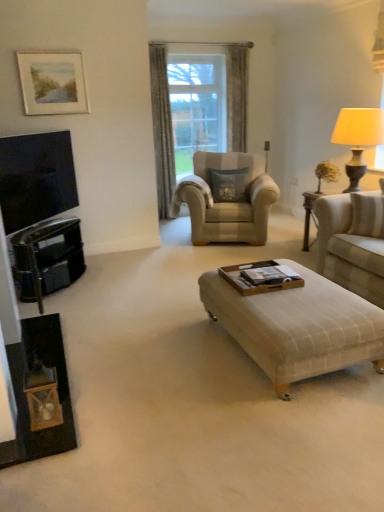
Question: Based on their positions, is gray textured curtain at center located to the left or right of beige fabric couch at right?

Choices:
 (A) right
 (B) left

Answer: (B)

Question: Is point (162, 74) closer or farther from the camera than point (350, 257)?

Choices:
 (A) farther
 (B) closer

Answer: (A)

Question: Estimate the real-world distances between objects in this image. Which object is closer to the black glossy dresser at left?

Choices:
 (A) matte beige lampshade at right
 (B) matte black tv at left
 (C) beige fabric couch at right
 (D) gray textured curtain at center
 (E) suede gray pillow at center

Answer: (B)

Question: Which object is positioned closest to the beige fabric armchair at center?

Choices:
 (A) matte beige lampshade at right
 (B) suede gray pillow at center
 (C) beige fabric couch at right
 (D) matte white picture frame at upper left
 (E) plaid fabric ottoman at center

Answer: (B)